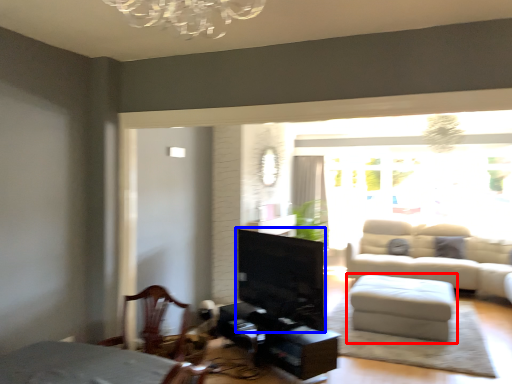
Question: Which of the following is the farthest to the observer, table (highlighted by a red box) or fireplace (highlighted by a blue box)?

Choices:
 (A) table
 (B) fireplace

Answer: (A)